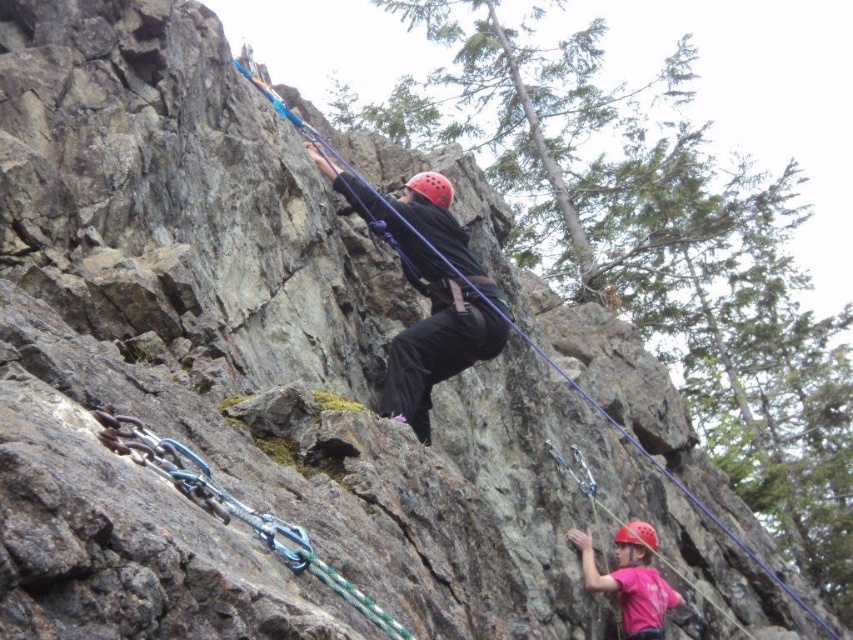
Can you confirm if pink fabric helmet at lower right is positioned to the left of matte red helmet at lower right?

Indeed, pink fabric helmet at lower right is positioned on the left side of matte red helmet at lower right.

Between point (607, 573) and point (641, 534), which one is positioned behind?

The point (641, 534) is behind.

Locate an element on the screen. The image size is (853, 640). pink fabric helmet at lower right is located at coordinates (630, 579).

Identify the location of pink fabric helmet at lower right. The height and width of the screenshot is (640, 853). tap(630, 579).

Does matte red helmet at lower right appear on the right side of red matte helmet at center?

Indeed, matte red helmet at lower right is positioned on the right side of red matte helmet at center.

Does matte red helmet at lower right have a greater width compared to red matte helmet at center?

No.

Find the location of a particular element. The image size is (853, 640). matte red helmet at lower right is located at coordinates (635, 541).

Between matte black helmet at center and red matte helmet at center, which one appears on the right side from the viewer's perspective?

red matte helmet at center

Based on the photo, can you confirm if matte black helmet at center is smaller than red matte helmet at center?

Incorrect, matte black helmet at center is not smaller in size than red matte helmet at center.

Does point (433, 298) come closer to viewer compared to point (444, 180)?

Yes.

Find the location of a particular element. This screenshot has width=853, height=640. matte black helmet at center is located at coordinates (427, 296).